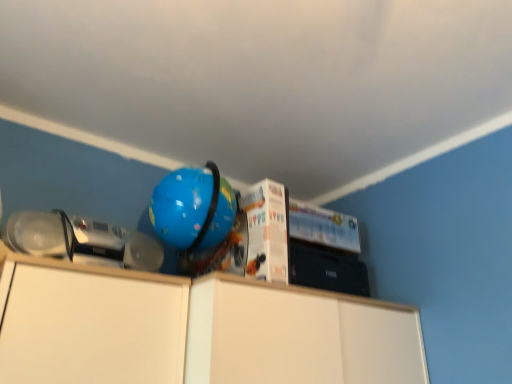
Image resolution: width=512 pixels, height=384 pixels. What do you see at coordinates (324, 227) in the screenshot?
I see `white glossy paperback book at upper center` at bounding box center [324, 227].

Identify the location of white glossy paperback book at upper center. (324, 227).

Where is `white glossy paperback book at upper center`? The width and height of the screenshot is (512, 384). white glossy paperback book at upper center is located at coordinates (324, 227).